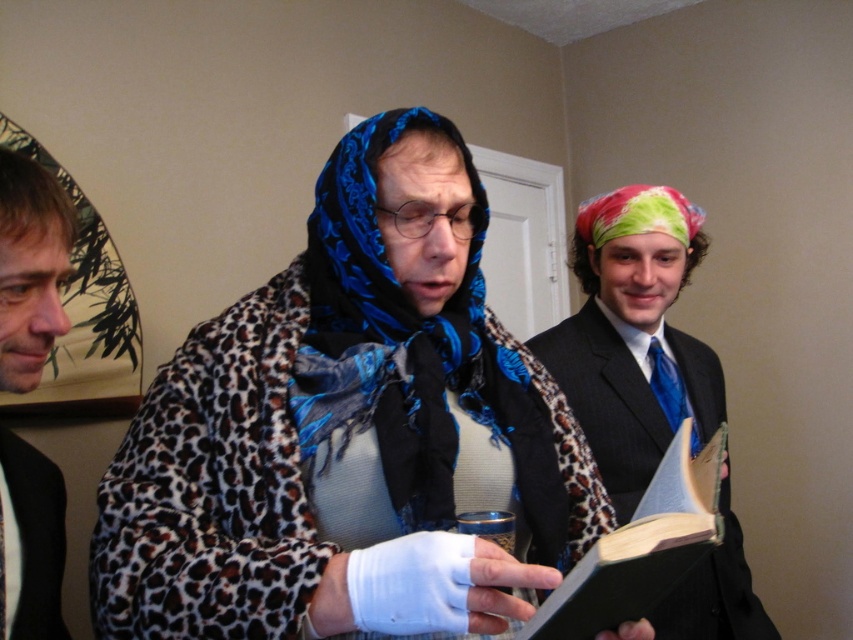
Question: Is blue printed scarf at center to the left of black satin business suit at left from the viewer's perspective?

Choices:
 (A) yes
 (B) no

Answer: (B)

Question: Which of the following is the closest to the observer?

Choices:
 (A) blonde hair at left
 (B) smooth brown hair at left

Answer: (B)

Question: Which point is farther to the camera?

Choices:
 (A) (16, 536)
 (B) (316, 337)
 (C) (660, 500)

Answer: (B)

Question: Estimate the real-world distances between objects in this image. Which object is closer to the blue printed scarf at center?

Choices:
 (A) black satin business suit at left
 (B) blonde hair at left

Answer: (A)

Question: Is hardcover book at center to the left of blonde hair at left from the viewer's perspective?

Choices:
 (A) yes
 (B) no

Answer: (B)

Question: Is blue printed scarf at center bigger than smooth brown hair at left?

Choices:
 (A) no
 (B) yes

Answer: (B)